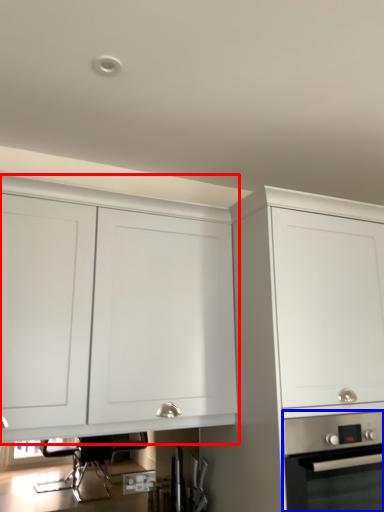
Question: Among these objects, which one is farthest to the camera, cabinetry (highlighted by a red box) or home appliance (highlighted by a blue box)?

Choices:
 (A) cabinetry
 (B) home appliance

Answer: (B)